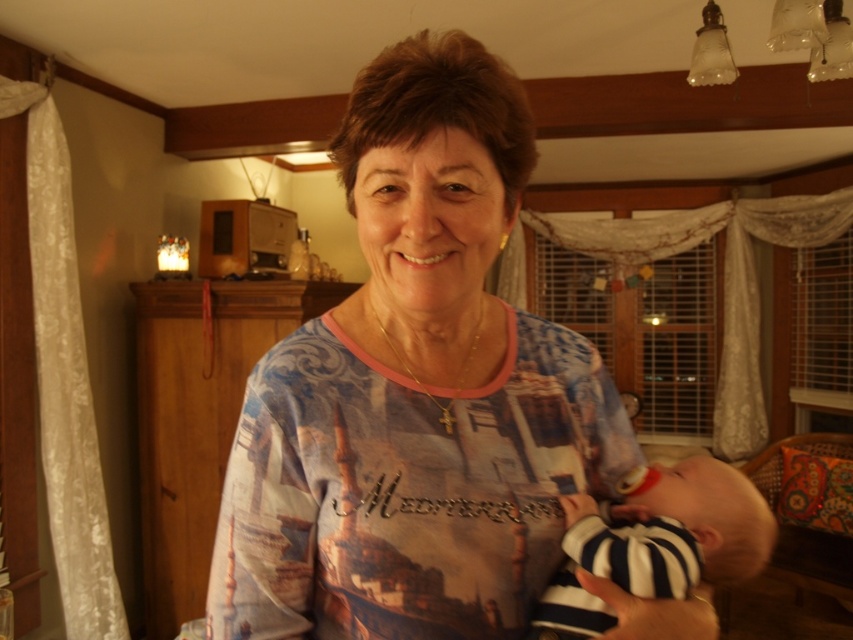
Question: From the image, what is the correct spatial relationship of blue printed shirt at center in relation to striped cotton onesie at center?

Choices:
 (A) above
 (B) below

Answer: (A)

Question: Can you confirm if blue printed shirt at center is wider than striped cotton onesie at center?

Choices:
 (A) no
 (B) yes

Answer: (B)

Question: Among these points, which one is nearest to the camera?

Choices:
 (A) (496, 620)
 (B) (659, 512)

Answer: (A)

Question: Is blue printed shirt at center below striped cotton onesie at center?

Choices:
 (A) yes
 (B) no

Answer: (B)